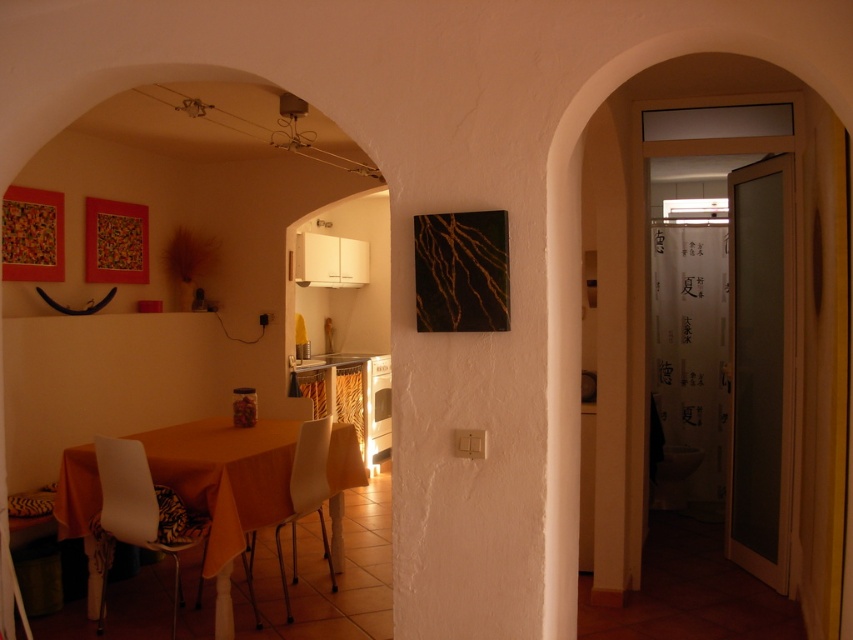
Question: Can you confirm if orange fabric table at center is positioned to the left of white plastic chair at lower left?

Choices:
 (A) yes
 (B) no

Answer: (B)

Question: Considering the relative positions of orange fabric table at center and white plastic chair at center in the image provided, where is orange fabric table at center located with respect to white plastic chair at center?

Choices:
 (A) above
 (B) below

Answer: (A)

Question: Which object is farther from the camera taking this photo?

Choices:
 (A) white plastic chair at center
 (B) white plastic chair at lower left
 (C) orange fabric table at center

Answer: (A)

Question: Which point appears closest to the camera in this image?

Choices:
 (A) [x=323, y=531]
 (B) [x=161, y=476]

Answer: (B)

Question: Is white plastic chair at lower left wider than white plastic chair at center?

Choices:
 (A) no
 (B) yes

Answer: (B)

Question: Considering the real-world distances, which object is farthest from the orange fabric table at center?

Choices:
 (A) white plastic chair at center
 (B) white plastic chair at lower left

Answer: (A)